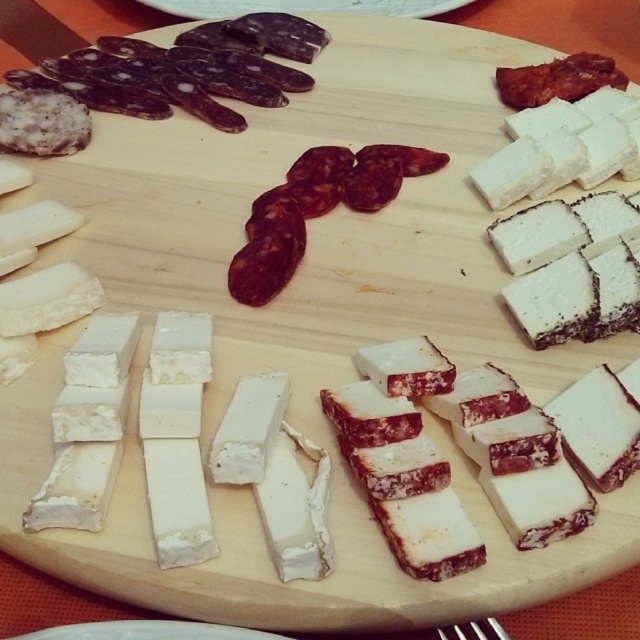
Question: Is dark brown cured meat at upper left thinner than white crumbly cheese at upper right?

Choices:
 (A) no
 (B) yes

Answer: (A)

Question: Which object is positioned closest to the metallic silver fork at lower center?

Choices:
 (A) white crumbly cheese at center
 (B) dark brown cured meat at upper left
 (C) dark red cured meat at center
 (D) white crumbly cheese at upper right

Answer: (A)

Question: Does dark red cured meat at center appear on the right side of white crumbly cheese at upper right?

Choices:
 (A) yes
 (B) no

Answer: (B)

Question: Which object is closer to the camera taking this photo?

Choices:
 (A) white crumbly cheese at upper right
 (B) dark brown cured meat at upper left
 (C) dark red cured meat at center

Answer: (C)

Question: Which object is the closest to the white crumbly cheese at center?

Choices:
 (A) white crumbly cheese at upper right
 (B) dark red cured meat at center
 (C) metallic silver fork at lower center
 (D) dark brown cured meat at upper left

Answer: (C)

Question: Where is dark red cured meat at center located in relation to metallic silver fork at lower center in the image?

Choices:
 (A) left
 (B) right

Answer: (A)